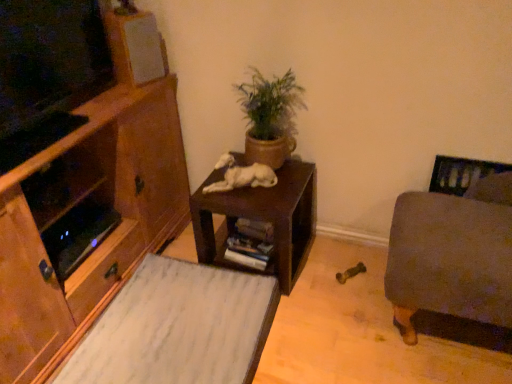
Locate an element on the screen. This screenshot has width=512, height=384. free space in front of white matte speaker at upper left is located at coordinates (113, 90).